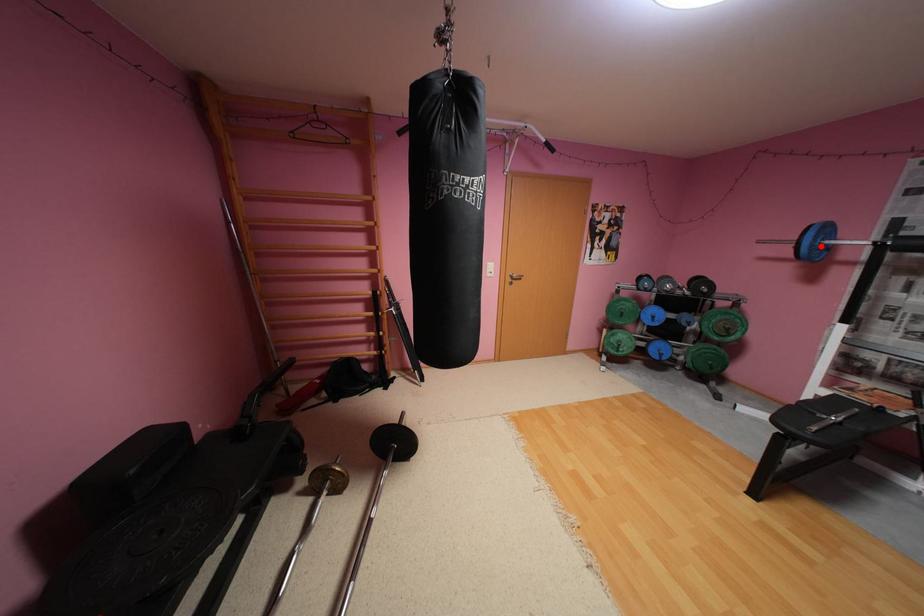
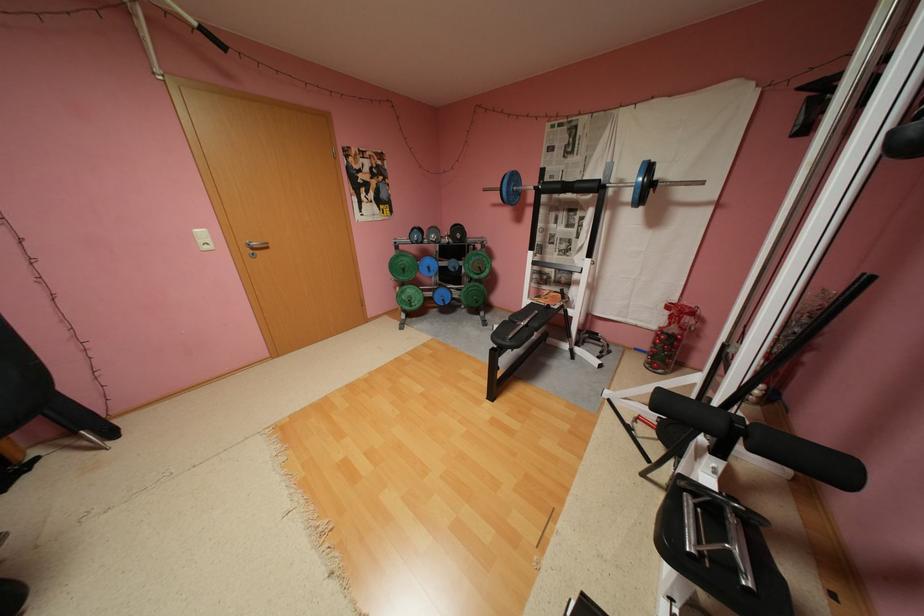
Question: I am providing you with two images of the same scene from different viewpoints. Image1 has a red point marked. In image2, the corresponding 3D location appears at what relative position? Reply with the corresponding letter.

Choices:
 (A) Closer
 (B) Farther

Answer: (A)